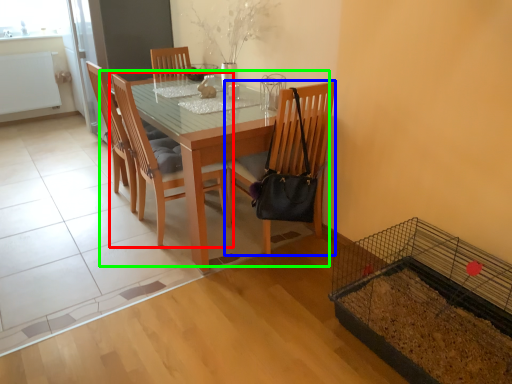
Question: Based on their relative distances, which object is nearer to chair (highlighted by a red box)? Choose from chair (highlighted by a blue box) and kitchen & dining room table (highlighted by a green box).

Choices:
 (A) chair
 (B) kitchen & dining room table

Answer: (B)